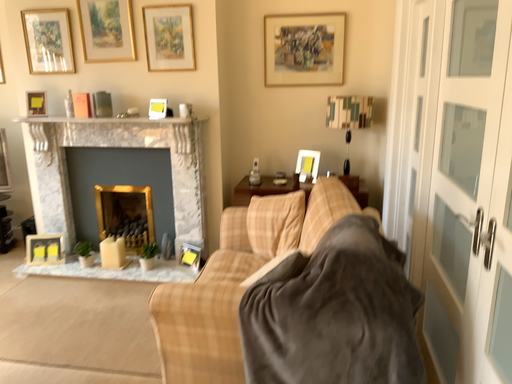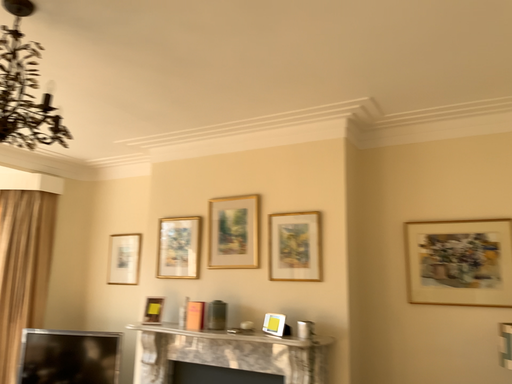
Question: How did the camera likely rotate when shooting the video?

Choices:
 (A) rotated upward
 (B) rotated downward

Answer: (A)